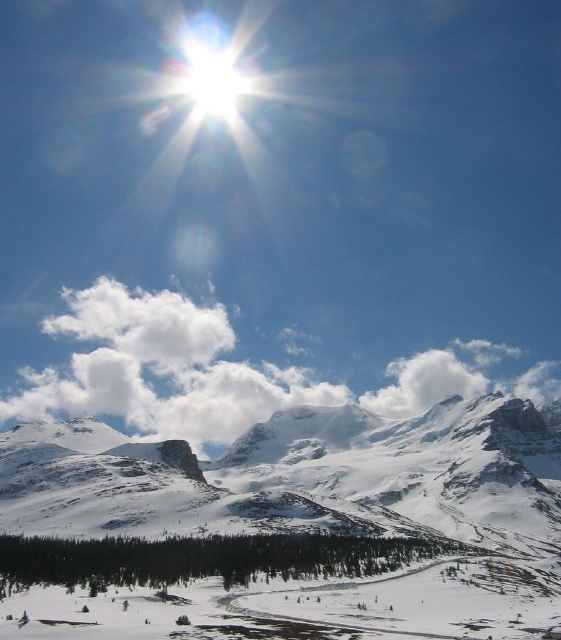
Consider the image. You are a photographer planning to capture a landscape shot of the bright white snow at upper center and the white fluffy cloud at upper left. The camera you are using has a maximum focus range of 75 meters. Will you be able to focus on both objects simultaneously?

The distance between the bright white snow at upper center and the white fluffy cloud at upper left is 76.67 meters. Since the camera can only focus up to 75 meters, it will not be able to capture both objects in focus at the same time.

You are a drone operator planning to fly a drone from the snowy granite mountain at center to the white fluffy cloud at upper left. Given that your drone has a maximum flight range of 200 meters, can it reach the cloud?

The snowy granite mountain at center and white fluffy cloud at upper left are 183.18 meters apart. Since the drone can fly up to 200 meters, it can reach the cloud as the distance is within its range.

You are a drone operator planning to fly a drone between the two white fluffy clouds in the alpine landscape. The drone has a maximum flight distance of 70 feet. Can you safely navigate the drone between the white fluffy cloud at center and the white fluffy cloud at upper left without exceeding its range?

The white fluffy cloud at center and white fluffy cloud at upper left are 69.50 feet apart from each other. Since the drone has a maximum flight distance of 70 feet, it can safely navigate between them as the distance is within the drone